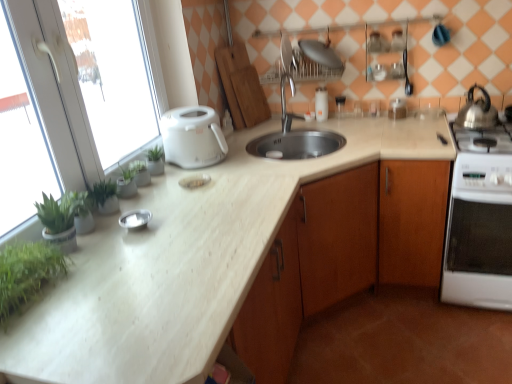
Locate an element on the screen. vacant space that is in between silver metallic bowl at center, which is the 1th appliance from front to back, and white glossy salt shaker at upper center, which ranks as the first appliance in back-to-front order is located at coordinates (228, 169).